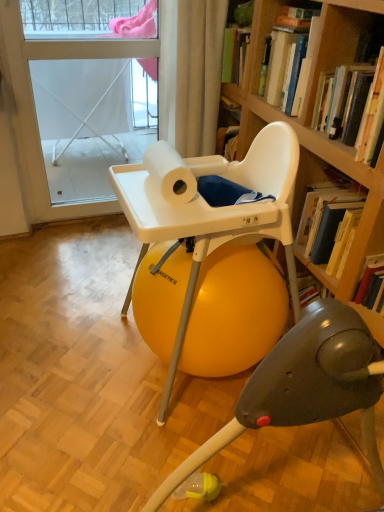
Question: Is white plastic highchair at center positioned behind hardcover book at upper right, which is the 1th book from back to front?

Choices:
 (A) no
 (B) yes

Answer: (A)

Question: Is white plastic highchair at center bigger than hardcover book at upper right, which is the 1th book from back to front?

Choices:
 (A) no
 (B) yes

Answer: (B)

Question: Can you confirm if white plastic highchair at center is positioned to the right of hardcover book at upper right, which is the 1th book from back to front?

Choices:
 (A) no
 (B) yes

Answer: (A)

Question: Can you confirm if white plastic highchair at center is positioned to the left of hardcover book at upper right, the 2th book from the front?

Choices:
 (A) no
 (B) yes

Answer: (B)

Question: Is white plastic highchair at center turned away from hardcover book at upper right, the 2th book from the front?

Choices:
 (A) yes
 (B) no

Answer: (B)

Question: From the image's perspective, relative to hardcover book at upper right, the 1th book from the front, is white matte paper towel at center above or below?

Choices:
 (A) above
 (B) below

Answer: (B)

Question: Visually, is white matte paper towel at center positioned to the left or to the right of hardcover book at upper right, the 1th book from the front?

Choices:
 (A) right
 (B) left

Answer: (B)

Question: From their relative heights in the image, would you say white matte paper towel at center is taller or shorter than hardcover book at upper right, which is the 2th book in back-to-front order?

Choices:
 (A) tall
 (B) short

Answer: (B)

Question: Considering the positions of point (168, 155) and point (364, 146), is point (168, 155) closer or farther from the camera than point (364, 146)?

Choices:
 (A) closer
 (B) farther

Answer: (B)

Question: Based on their positions, is white plastic highchair at center located to the left or right of white fabric screen door at upper left?

Choices:
 (A) right
 (B) left

Answer: (A)

Question: From a real-world perspective, relative to white fabric screen door at upper left, is white plastic highchair at center vertically above or below?

Choices:
 (A) below
 (B) above

Answer: (A)

Question: In terms of size, does white plastic highchair at center appear bigger or smaller than white fabric screen door at upper left?

Choices:
 (A) small
 (B) big

Answer: (B)

Question: Is white plastic highchair at center taller or shorter than white fabric screen door at upper left?

Choices:
 (A) tall
 (B) short

Answer: (B)

Question: Considering the positions of hardcover book at upper right, which is the 2th book in back-to-front order, and white fabric screen door at upper left in the image, is hardcover book at upper right, which is the 2th book in back-to-front order, taller or shorter than white fabric screen door at upper left?

Choices:
 (A) tall
 (B) short

Answer: (B)

Question: Is hardcover book at upper right, the 1th book from the front, wider or thinner than white fabric screen door at upper left?

Choices:
 (A) wide
 (B) thin

Answer: (A)